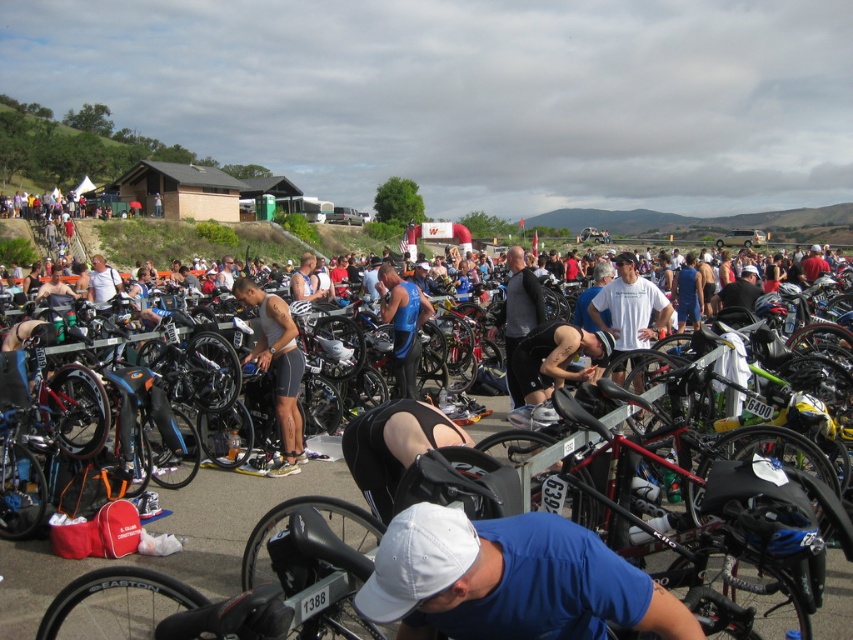
You are a photographer at the triathlon event and want to capture a photo of the blue fabric shirt at center and the black matte vest at center. Which clothing item is shorter in length?

The blue fabric shirt at center is shorter than the black matte vest at center.

Looking at this image, you are a participant in the triathlon and need to move from your position to retrieve an item located at point [511,248]. However, there is an obstacle at point [285,408]. Will you encounter this obstacle before reaching your destination?

Yes, you will encounter the obstacle at point [285,408] before reaching point [511,248] because point [285,408] is in front of point [511,248].